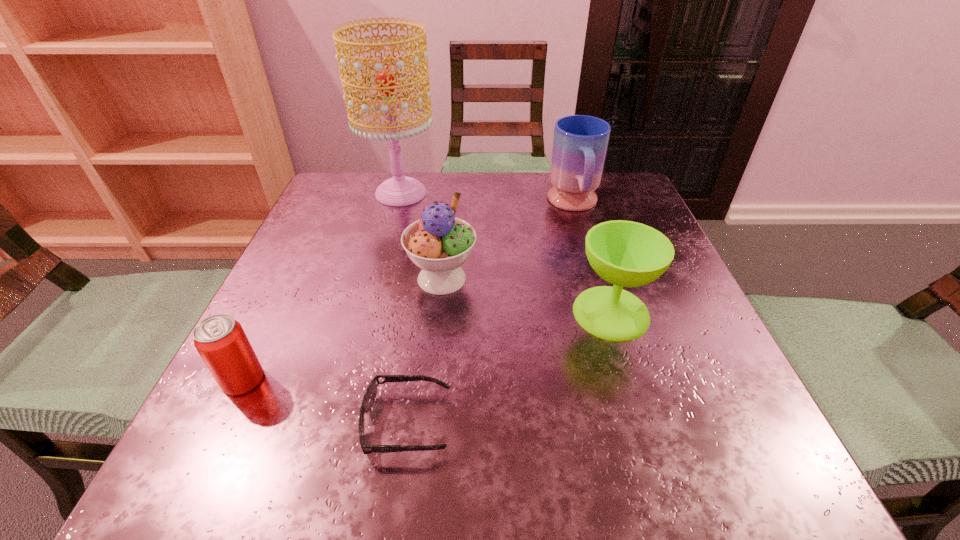
You are a GUI agent. You are given a task and a screenshot of the screen. Output one action in this format:
    pyautogui.click(x=<x>, y=<y>)
    Task: Click on the vacant space that satisfies the following two spatial constraints: 1. on the front side of the icecream; 2. on the left side of the tallest object
    
    Given the screenshot: What is the action you would take?
    pyautogui.click(x=378, y=279)

Locate an element on the screen. This screenshot has width=960, height=540. blank space that satisfies the following two spatial constraints: 1. on the side of the mug with the handle; 2. on the front-facing side of the sunglasses is located at coordinates (639, 423).

Identify the location of vacant region that satisfies the following two spatial constraints: 1. on the side of the mug with the handle; 2. on the front-facing side of the shortest object. (639, 423).